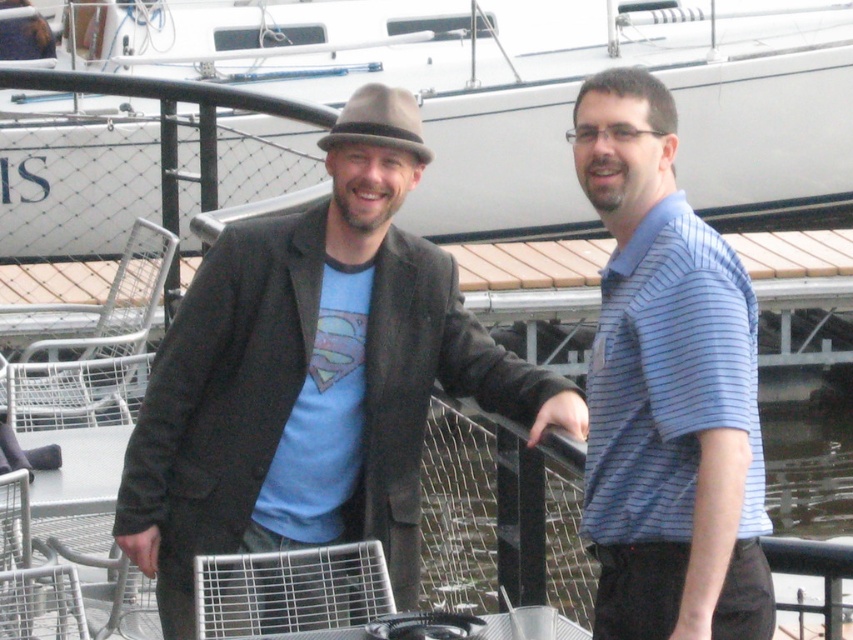
Who is taller, black leather handle at center or matte black hand at lower right?

With more height is black leather handle at center.

Can you confirm if black leather handle at center is wider than matte black hand at lower right?

Answer: Yes, black leather handle at center is wider than matte black hand at lower right.

Between point (578, 432) and point (691, 620), which one is positioned behind?

Point (578, 432)

Image resolution: width=853 pixels, height=640 pixels. What are the coordinates of `black leather handle at center` in the screenshot? It's located at point(561,417).

Who is positioned more to the left, matte black jacket at center or blue striped polo shirt at center?

From the viewer's perspective, matte black jacket at center appears more on the left side.

Who is more distant from viewer, (263, 256) or (756, 444)?

Point (263, 256)

Locate an element on the screen. matte black jacket at center is located at coordinates (306, 387).

Does matte black jacket at center lie behind white matte boat at upper center?

No, matte black jacket at center is in front of white matte boat at upper center.

Between point (526, 364) and point (422, 186), which one is positioned in front?

Point (526, 364)

Is point (292, 301) more distant than point (506, 22)?

No, (292, 301) is closer to viewer.

I want to click on matte black jacket at center, so [x=306, y=387].